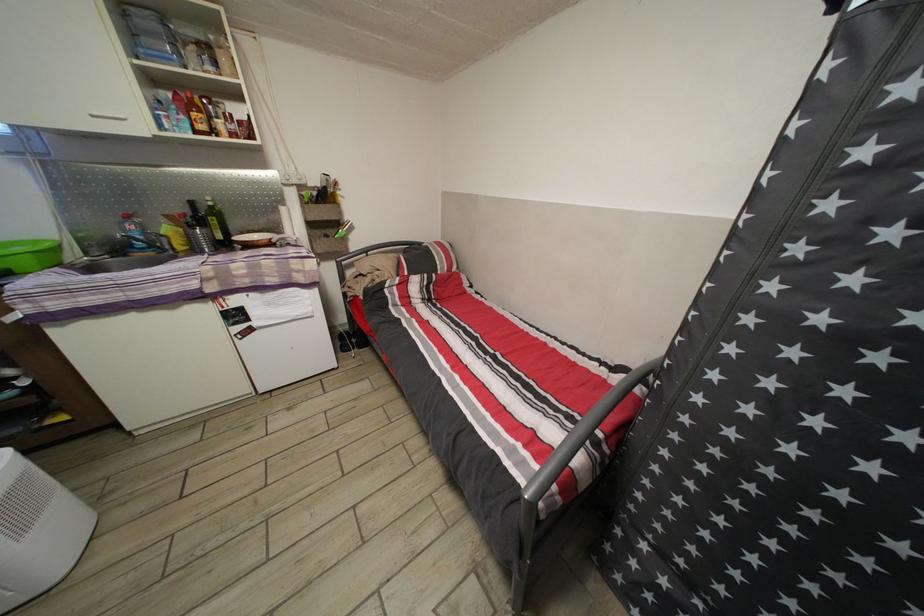
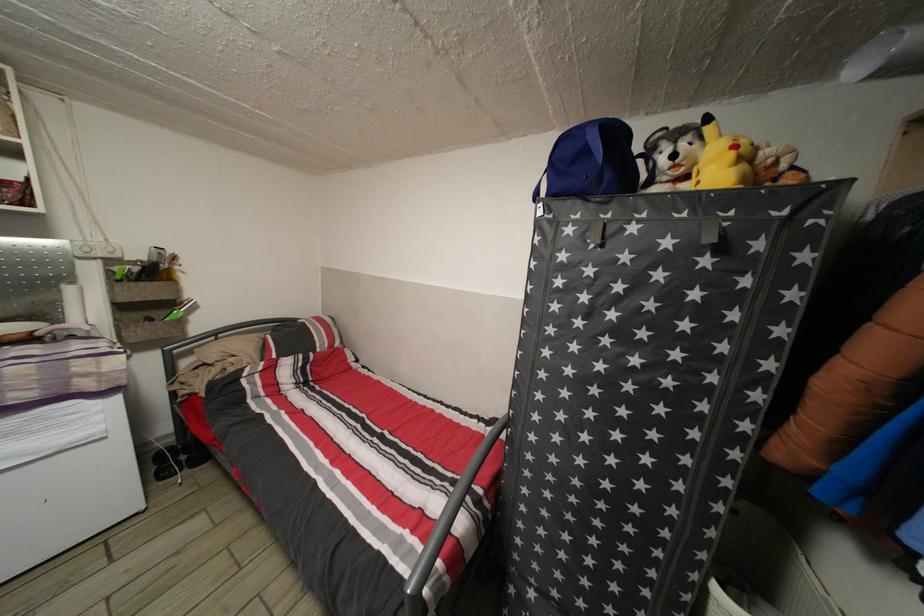
The point at (334, 213) is marked in the first image. Where is the corresponding point in the second image?

(164, 291)